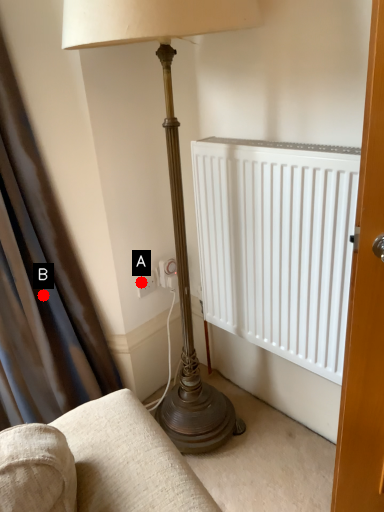
Question: Two points are circled on the image, labeled by A and B beside each circle. Which of the following is the farthest from the observer?

Choices:
 (A) A is further
 (B) B is further

Answer: (A)